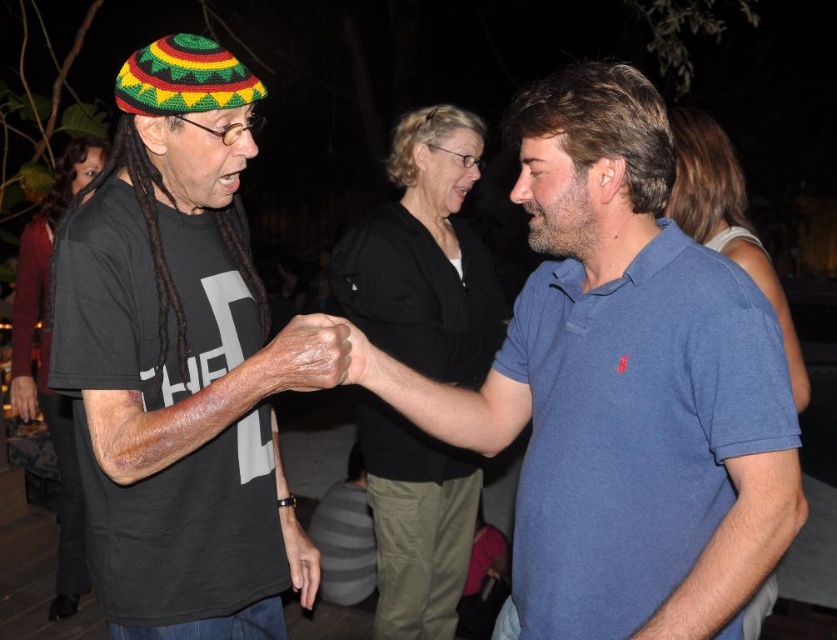
Question: Is black matte t-shirt at left positioned before leather-like skin at center?

Choices:
 (A) yes
 (B) no

Answer: (A)

Question: Which point appears farthest from the camera in this image?

Choices:
 (A) (627, 337)
 (B) (345, 356)
 (C) (353, 324)

Answer: (C)

Question: Considering the real-world distances, which object is closest to the leather-like skin at center?

Choices:
 (A) black matte t-shirt at left
 (B) blue cotton polo shirt at center
 (C) dry skin at center

Answer: (C)

Question: Does blue cotton polo shirt at center appear over dry skin at center?

Choices:
 (A) no
 (B) yes

Answer: (B)

Question: From the image, what is the correct spatial relationship of blue cotton polo shirt at center in relation to dry skin at center?

Choices:
 (A) right
 (B) left

Answer: (A)

Question: Which is nearer to the leather-like skin at center?

Choices:
 (A) black matte t-shirt at left
 (B) dry skin at center
 (C) blue cotton polo shirt at center

Answer: (B)